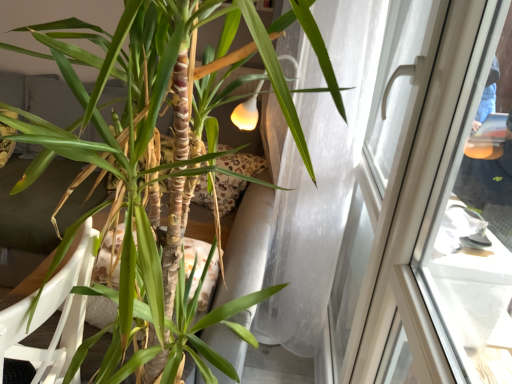
Question: Considering the positions of point (64, 355) and point (83, 104), is point (64, 355) closer or farther from the camera than point (83, 104)?

Choices:
 (A) farther
 (B) closer

Answer: (A)

Question: Is white plastic armchair at lower left taller or shorter than green matte plant at center?

Choices:
 (A) tall
 (B) short

Answer: (B)

Question: Based on their relative distances, which object is farther from the white plastic armchair at lower left?

Choices:
 (A) transparent glass window at upper right
 (B) green matte plant at center

Answer: (A)

Question: Which of these objects is positioned closest to the white plastic armchair at lower left?

Choices:
 (A) transparent glass window at upper right
 (B) green matte plant at center

Answer: (B)